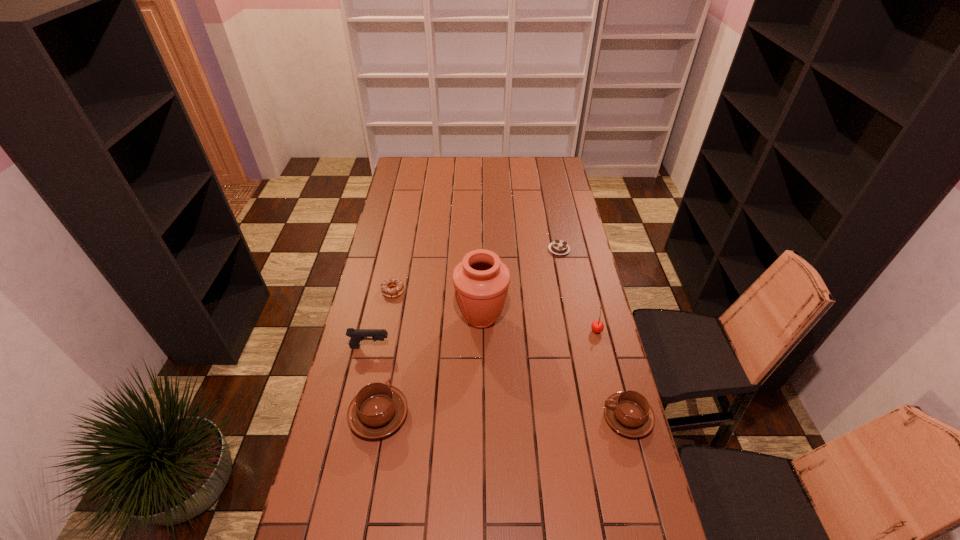
Locate an element on the screen. The image size is (960, 540). vacant region between the shorter cappuccino and the third nearest object is located at coordinates (499, 382).

Identify the location of object that is the second closest to the fourth object from right to left. (356, 335).

Where is `object that can be found as the third closest to the left cappuccino`? This screenshot has height=540, width=960. object that can be found as the third closest to the left cappuccino is located at coordinates click(396, 282).

This screenshot has height=540, width=960. What are the coordinates of `free location that satisfies the following two spatial constraints: 1. on the side of the farthest object with the handle; 2. on the right side of the taller cappuccino` in the screenshot? It's located at (409, 249).

I want to click on vacant area in the image that satisfies the following two spatial constraints: 1. on the side of the taller cappuccino with the handle; 2. on the right side of the cherry, so click(x=395, y=330).